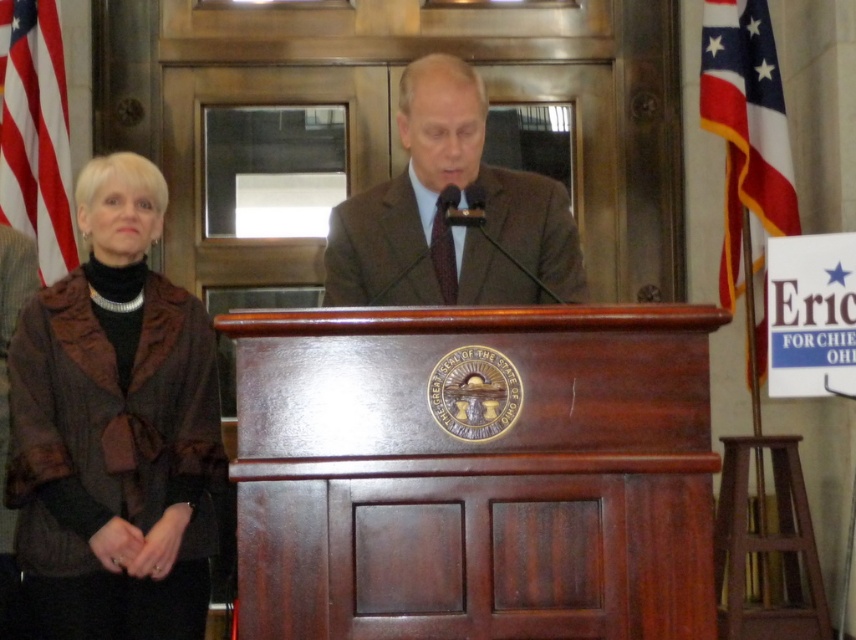
Question: Is brown textured coat at left further to camera compared to red fabric flag at left?

Choices:
 (A) no
 (B) yes

Answer: (A)

Question: Which object is closer to the camera taking this photo?

Choices:
 (A) red fabric flag at left
 (B) brown textured coat at left

Answer: (B)

Question: Among these points, which one is nearest to the camera?

Choices:
 (A) (27, 195)
 (B) (724, 176)
 (C) (36, 472)
 (D) (575, 250)

Answer: (C)

Question: Can you confirm if brown textured coat at left is smaller than polyester flag at right?

Choices:
 (A) no
 (B) yes

Answer: (A)

Question: Which of the following is the closest to the observer?

Choices:
 (A) (721, 52)
 (B) (516, 205)

Answer: (B)

Question: Can you confirm if brown textured coat at left is positioned below brown textured suit at center?

Choices:
 (A) no
 (B) yes

Answer: (B)